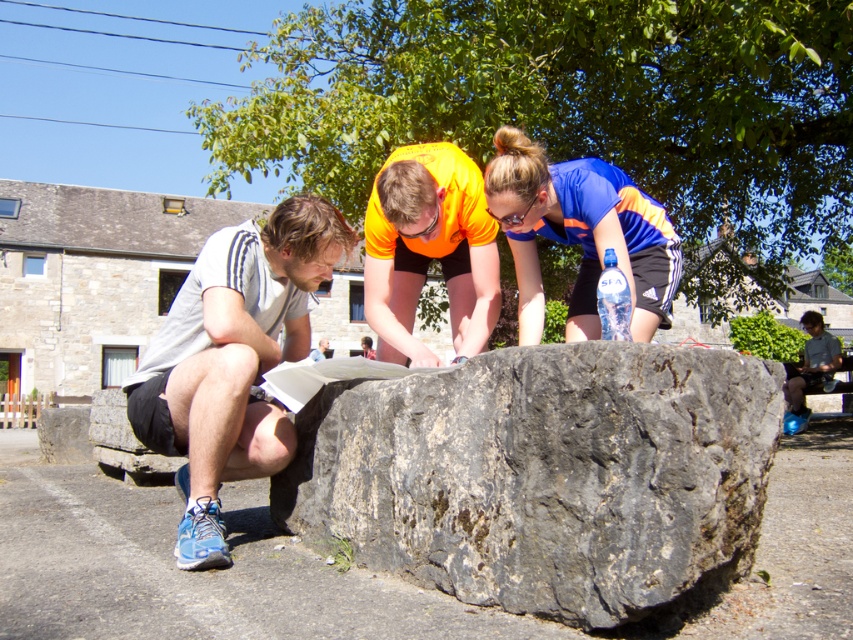
You are a hiker who needs to place a transparent plastic bottle at center on top of the gray rough stone at center. Can you do that?

The gray rough stone at center is below the transparent plastic bottle at center, so yes, you can place the transparent plastic bottle at center on top of the gray rough stone at center.